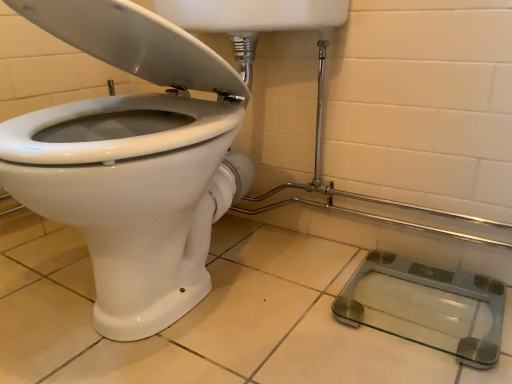
Find the location of a particular element. This screenshot has height=384, width=512. transparent glass scale at lower right is located at coordinates (425, 306).

The image size is (512, 384). What do you see at coordinates (425, 306) in the screenshot? I see `transparent glass scale at lower right` at bounding box center [425, 306].

You are a GUI agent. You are given a task and a screenshot of the screen. Output one action in this format:
    pyautogui.click(x=<x>, y=<y>)
    Task: Click on the transparent glass scale at lower right
    Image resolution: width=512 pixels, height=384 pixels.
    Given the screenshot: What is the action you would take?
    pyautogui.click(x=425, y=306)